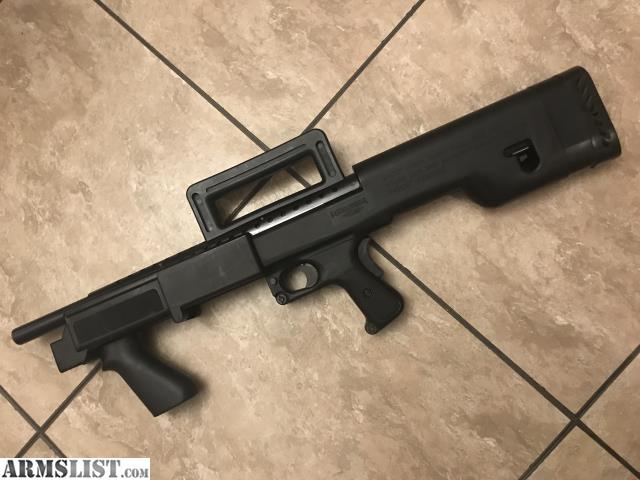
Where is `floor seen through the opening`? The image size is (640, 480). floor seen through the opening is located at coordinates (276, 192).